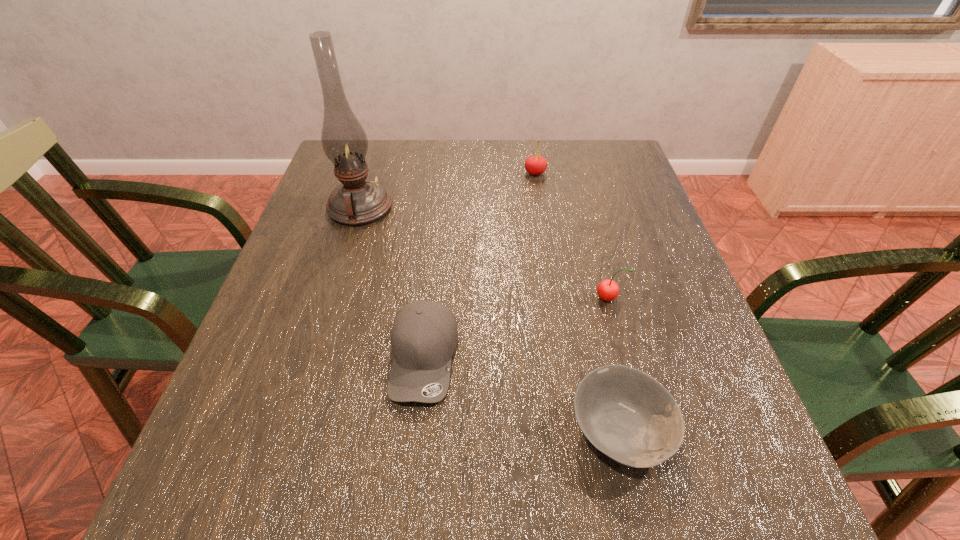
Locate an element on the screen. the tallest object is located at coordinates [x=357, y=201].

This screenshot has height=540, width=960. I want to click on the fourth nearest object, so click(x=357, y=201).

This screenshot has height=540, width=960. Find the location of `the farthest object`. the farthest object is located at coordinates (535, 165).

At what (x,y) coordinates should I click in order to perform the action: click on the taller cherry. Please return your answer as a coordinate pair (x, y). This screenshot has width=960, height=540. Looking at the image, I should click on (535, 165).

Identify the location of baseball cap. This screenshot has height=540, width=960. point(424,335).

Identify the location of the right cherry. (608, 290).

Where is `the nearer cherry`? The image size is (960, 540). the nearer cherry is located at coordinates (608, 290).

Image resolution: width=960 pixels, height=540 pixels. What are the coordinates of `the shortest object` in the screenshot? It's located at (629, 416).

This screenshot has width=960, height=540. What are the coordinates of `free location located 0.090m on the right of the second farthest object` in the screenshot? It's located at (427, 208).

Where is `blank space located on the front of the farthest object`? The width and height of the screenshot is (960, 540). blank space located on the front of the farthest object is located at coordinates (551, 274).